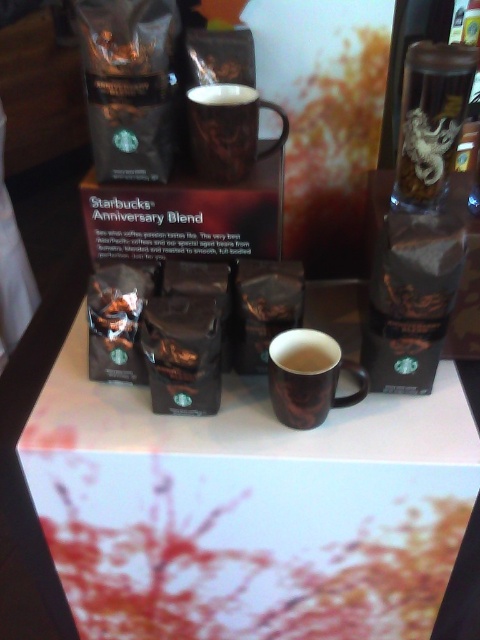
Is transparent glass at upper right behind brown glossy mug at center?

No, it is not.

Measure the distance from transparent glass at upper right to brown glossy mug at center.

The distance of transparent glass at upper right from brown glossy mug at center is 31.34 centimeters.

Between point (407, 93) and point (314, 360), which one is positioned in front?

Positioned in front is point (407, 93).

Where is `transparent glass at upper right`? The image size is (480, 640). transparent glass at upper right is located at coordinates (431, 120).

Is point (217, 97) positioned before point (322, 358)?

That is False.

Locate an element on the screen. The width and height of the screenshot is (480, 640). brown glossy mug at upper center is located at coordinates (228, 131).

Is white glossy table at center thinner than brown matte mug at center?

No, white glossy table at center is not thinner than brown matte mug at center.

Is point (388, 428) farther from viewer compared to point (303, 339)?

That is False.

Is point (299, 465) farther from viewer compared to point (271, 362)?

No, it is in front of (271, 362).

At what (x,y) coordinates should I click in order to perform the action: click on white glossy table at center. Please return your answer as a coordinate pair (x, y). This screenshot has width=480, height=640. Looking at the image, I should click on (248, 508).